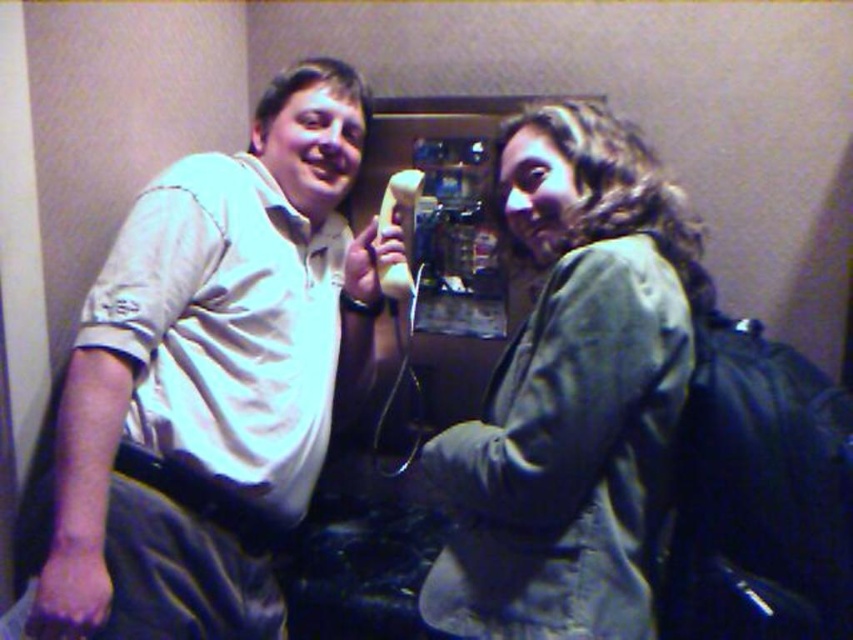
From the picture: Where is the matte white shirt at upper left located in the image?

The matte white shirt at upper left is located at point (210, 376) in the image.

You are an interior designer analyzing the placement of objects in this room. You notice a point at coordinates [210,376]. What object is located at this point?

The point at coordinates [210,376] indicates the matte white shirt at upper left.

You are a delivery robot that is 16 inches wide. You need to pass between the matte white shirt at upper left and the green fabric jacket at upper right. Can you fit through the space between them?

The distance between the matte white shirt at upper left and the green fabric jacket at upper right is 17.48 inches. Since the robot is 16 inches wide, it can fit through the space between them as 17.48 inches is wider than the robot.